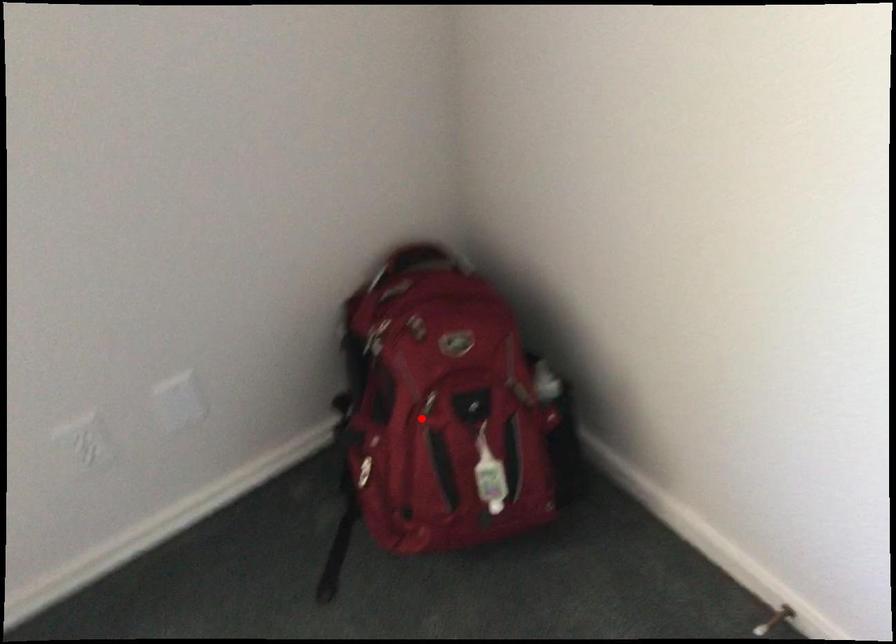
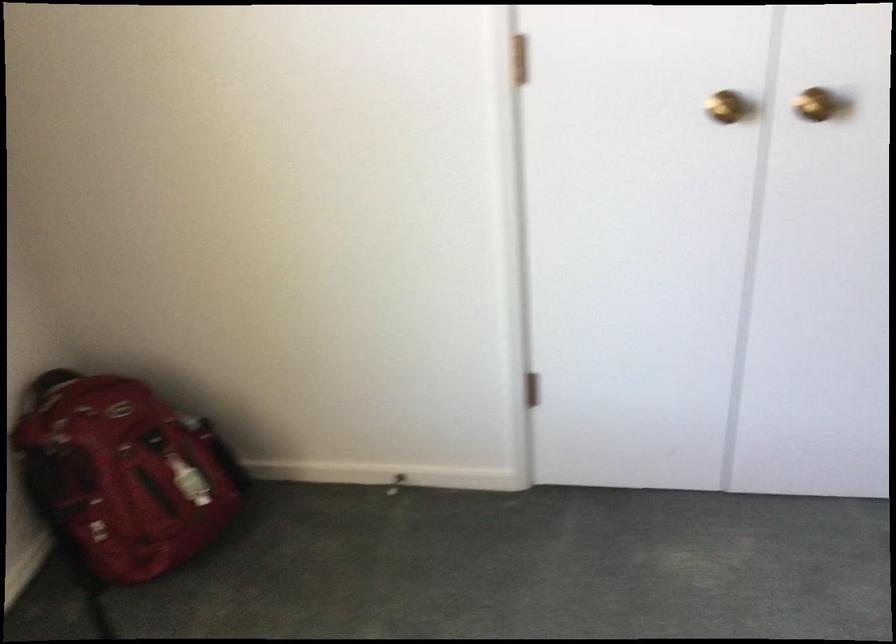
In the second image, find the point that corresponds to the highlighted location in the first image.

(123, 474)